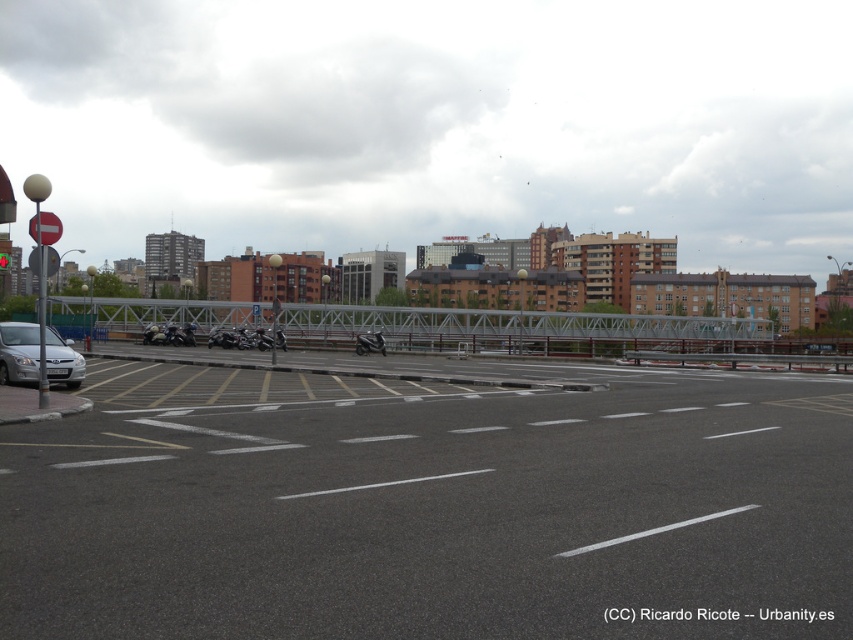
Question: Does metallic gray bridge at center appear on the left side of shiny black motorcycle at center?

Choices:
 (A) yes
 (B) no

Answer: (B)

Question: Which object appears closest to the camera in this image?

Choices:
 (A) red plastic sign at upper left
 (B) shiny black motorcycle at center
 (C) silver metallic car at lower left

Answer: (A)

Question: Can you confirm if metallic gray bridge at center is smaller than red plastic sign at upper left?

Choices:
 (A) no
 (B) yes

Answer: (A)

Question: Which of these objects is positioned farthest from the metallic gray bridge at center?

Choices:
 (A) shiny black motorcycle at center
 (B) gray asphalt parking lot at center

Answer: (B)

Question: Does gray asphalt parking lot at center appear on the left side of shiny black motorcycle at center?

Choices:
 (A) no
 (B) yes

Answer: (A)

Question: Which of the following is the farthest from the observer?

Choices:
 (A) red plastic sign at upper left
 (B) gray asphalt parking lot at center
 (C) shiny black motorcycle at center
 (D) silver metallic car at lower left

Answer: (C)